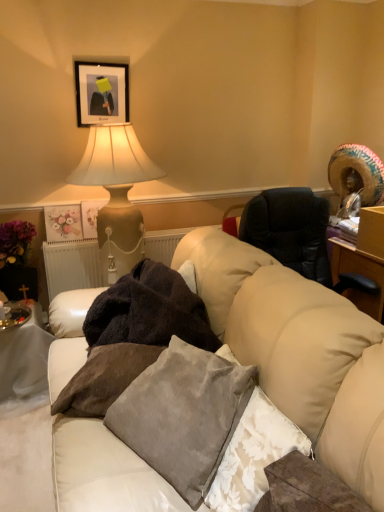
Question: From the image's perspective, is white fabric table at lower left under matte beige lamp at upper left?

Choices:
 (A) yes
 (B) no

Answer: (A)

Question: From a real-world perspective, is white fabric table at lower left positioned over matte beige lamp at upper left based on gravity?

Choices:
 (A) no
 (B) yes

Answer: (A)

Question: From a real-world perspective, does white fabric table at lower left sit lower than matte beige lamp at upper left?

Choices:
 (A) yes
 (B) no

Answer: (A)

Question: Is the depth of white fabric table at lower left less than that of matte beige lamp at upper left?

Choices:
 (A) yes
 (B) no

Answer: (B)

Question: Is white fabric table at lower left bigger than matte beige lamp at upper left?

Choices:
 (A) yes
 (B) no

Answer: (B)

Question: Relative to matte black picture frame at upper left, is dark fuzzy blanket at center in front or behind?

Choices:
 (A) behind
 (B) front

Answer: (B)

Question: From a real-world perspective, is dark fuzzy blanket at center physically located above or below matte black picture frame at upper left?

Choices:
 (A) above
 (B) below

Answer: (B)

Question: From their relative heights in the image, would you say dark fuzzy blanket at center is taller or shorter than matte black picture frame at upper left?

Choices:
 (A) short
 (B) tall

Answer: (A)

Question: Looking at the image, does dark fuzzy blanket at center seem bigger or smaller compared to matte black picture frame at upper left?

Choices:
 (A) big
 (B) small

Answer: (A)

Question: Considering the positions of velvet gray pillow at center, marked as the 3th pillow in a left-to-right arrangement, and matte beige lamp at upper left in the image, is velvet gray pillow at center, marked as the 3th pillow in a left-to-right arrangement, taller or shorter than matte beige lamp at upper left?

Choices:
 (A) tall
 (B) short

Answer: (B)

Question: In terms of width, does velvet gray pillow at center, marked as the 3th pillow in a left-to-right arrangement, look wider or thinner when compared to matte beige lamp at upper left?

Choices:
 (A) wide
 (B) thin

Answer: (B)

Question: Considering their positions, is velvet gray pillow at center, the 1th pillow from the right, located in front of or behind matte beige lamp at upper left?

Choices:
 (A) behind
 (B) front

Answer: (B)

Question: Does point (215, 496) appear closer or farther from the camera than point (129, 210)?

Choices:
 (A) closer
 (B) farther

Answer: (A)

Question: From the image's perspective, is velvet gray pillow at center, the 1th pillow from the right, positioned above or below velvet gray pillow at center, which appears as the first pillow when viewed from the left?

Choices:
 (A) above
 (B) below

Answer: (B)

Question: Would you say velvet gray pillow at center, marked as the 3th pillow in a left-to-right arrangement, is inside or outside velvet gray pillow at center, which appears as the third pillow when viewed from the right?

Choices:
 (A) outside
 (B) inside

Answer: (A)